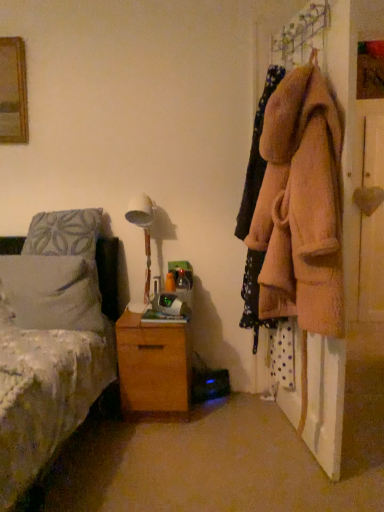
Question: Does white fabric lampshade at center come behind white soft pillow at left?

Choices:
 (A) yes
 (B) no

Answer: (A)

Question: Does white fabric lampshade at center touch white soft pillow at left?

Choices:
 (A) yes
 (B) no

Answer: (B)

Question: Is white fabric lampshade at center positioned beyond the bounds of white soft pillow at left?

Choices:
 (A) no
 (B) yes

Answer: (B)

Question: Is white fabric lampshade at center far away from white soft pillow at left?

Choices:
 (A) yes
 (B) no

Answer: (B)

Question: From the image's perspective, is white fabric lampshade at center on top of white soft pillow at left?

Choices:
 (A) no
 (B) yes

Answer: (B)

Question: Is white fabric lampshade at center closer to camera compared to white soft pillow at left?

Choices:
 (A) yes
 (B) no

Answer: (B)

Question: Is wooden heart at right not near fuzzy pink coat at right?

Choices:
 (A) yes
 (B) no

Answer: (B)

Question: From a real-world perspective, is wooden heart at right on top of fuzzy pink coat at right?

Choices:
 (A) no
 (B) yes

Answer: (A)

Question: Is wooden heart at right positioned in front of fuzzy pink coat at right?

Choices:
 (A) no
 (B) yes

Answer: (A)

Question: Is fuzzy pink coat at right at the back of wooden heart at right?

Choices:
 (A) no
 (B) yes

Answer: (A)

Question: From the image's perspective, is wooden heart at right located beneath fuzzy pink coat at right?

Choices:
 (A) yes
 (B) no

Answer: (B)

Question: Is wooden heart at right thinner than fuzzy pink coat at right?

Choices:
 (A) yes
 (B) no

Answer: (B)

Question: Can you confirm if white soft pillow at left is shorter than wooden chest of drawers at lower center?

Choices:
 (A) no
 (B) yes

Answer: (B)